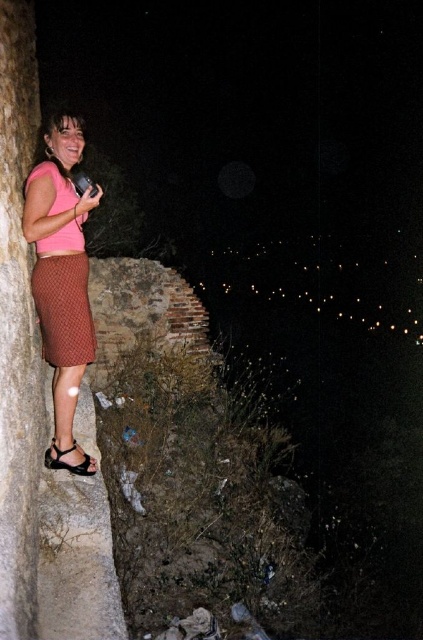
This screenshot has width=423, height=640. What do you see at coordinates (63, 296) in the screenshot? I see `brown textured dress at left` at bounding box center [63, 296].

Can you confirm if brown textured dress at left is positioned below black leather sandal at lower left?

Incorrect, brown textured dress at left is not positioned below black leather sandal at lower left.

This screenshot has width=423, height=640. What do you see at coordinates (63, 296) in the screenshot?
I see `brown textured dress at left` at bounding box center [63, 296].

Image resolution: width=423 pixels, height=640 pixels. In order to click on brown textured dress at left in this screenshot , I will do `click(63, 296)`.

Can you confirm if pink fabric skirt at left is positioned below black leather sandal at lower left?

Actually, pink fabric skirt at left is above black leather sandal at lower left.

Between pink fabric skirt at left and black leather sandal at lower left, which one is positioned higher?

pink fabric skirt at left is above.

Where is `pink fabric skirt at left`? The image size is (423, 640). pink fabric skirt at left is located at coordinates (62, 280).

You are a GUI agent. You are given a task and a screenshot of the screen. Output one action in this format:
    pyautogui.click(x=<x>, y=<y>)
    Task: Click on the pink fabric skirt at left
    
    Given the screenshot: What is the action you would take?
    pyautogui.click(x=62, y=280)

Does pink fabric skirt at left have a lesser height compared to brown textured dress at left?

In fact, pink fabric skirt at left may be taller than brown textured dress at left.

Does pink fabric skirt at left appear under brown textured dress at left?

Indeed, pink fabric skirt at left is positioned under brown textured dress at left.

This screenshot has height=640, width=423. I want to click on pink fabric skirt at left, so click(x=62, y=280).